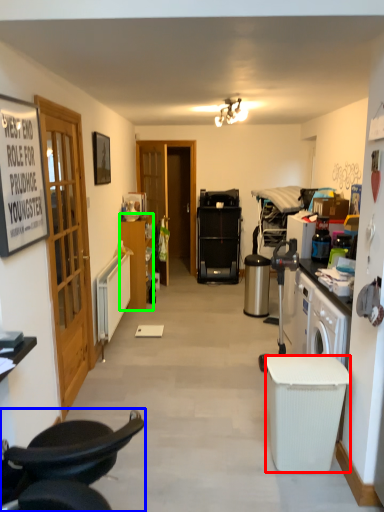
Question: Which is nearer to the trash bin/can (highlighted by a red box)? chair (highlighted by a blue box) or cabinetry (highlighted by a green box).

Choices:
 (A) chair
 (B) cabinetry

Answer: (A)